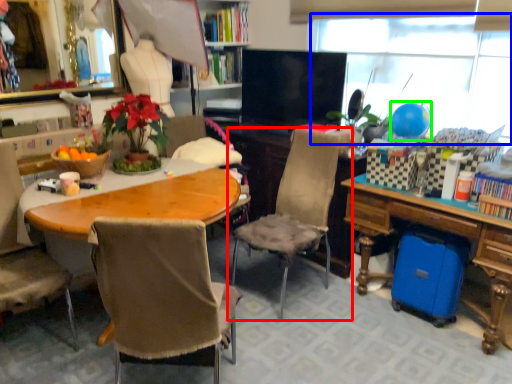
Question: Estimate the real-world distances between objects in this image. Which object is farther from chair (highlighted by a red box), window screen (highlighted by a blue box) or balloon (highlighted by a green box)?

Choices:
 (A) window screen
 (B) balloon

Answer: (A)